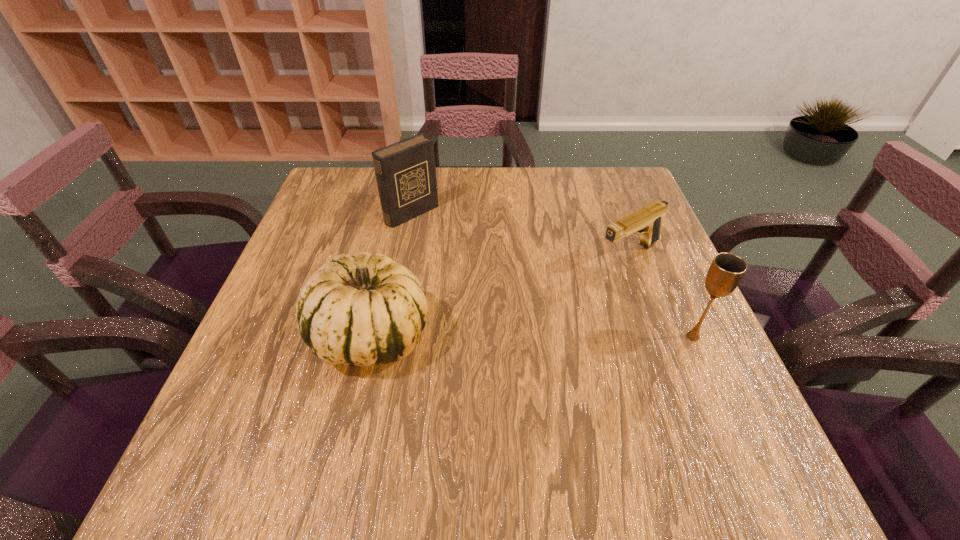
Where is `free space located 0.170m at the barrel of the second farthest object`? The height and width of the screenshot is (540, 960). free space located 0.170m at the barrel of the second farthest object is located at coordinates (549, 296).

Find the location of `vacant space situated at the barrel of the second farthest object`. vacant space situated at the barrel of the second farthest object is located at coordinates (572, 283).

Find the location of a particular element. blank area located at the barrel of the second farthest object is located at coordinates (542, 300).

Locate an element on the screen. object at the far edge is located at coordinates (405, 171).

Identify the location of object positioned at the near edge. This screenshot has height=540, width=960. (366, 310).

Where is `object located at the left edge`? The height and width of the screenshot is (540, 960). object located at the left edge is located at coordinates (366, 310).

Locate an element on the screen. The height and width of the screenshot is (540, 960). chalice located in the right edge section of the desktop is located at coordinates (726, 271).

At what (x,y) coordinates should I click in order to perform the action: click on pistol situated at the right edge. Please return your answer as a coordinate pair (x, y). This screenshot has width=960, height=540. Looking at the image, I should click on (647, 222).

Locate an element on the screen. This screenshot has height=540, width=960. object situated at the near left corner is located at coordinates pyautogui.click(x=366, y=310).

In the image, there is a desktop. Where is `vacant space at the far edge`? vacant space at the far edge is located at coordinates (505, 186).